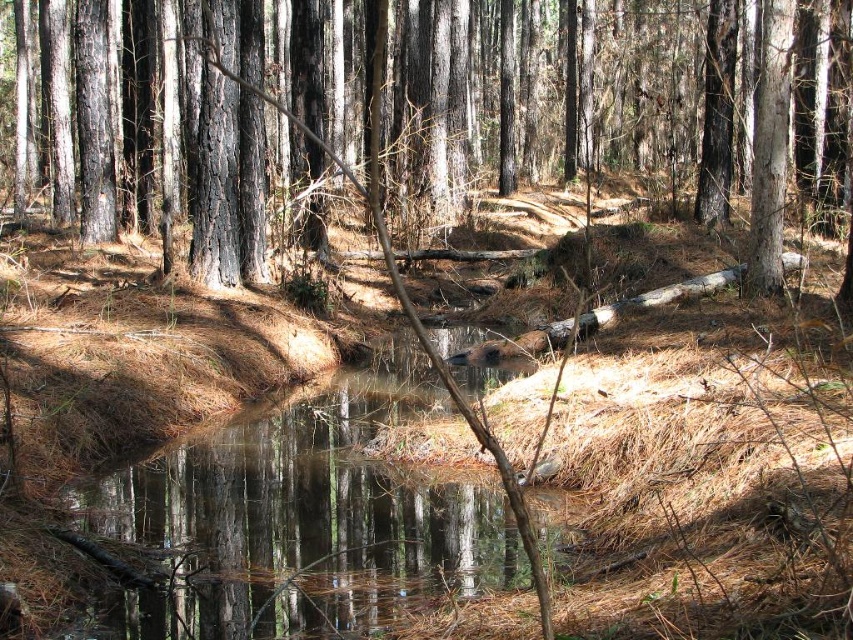
You are a hiker trying to cross the stream in the forest. You see a smooth bark tree at center and a clear water at center. Which one is wider? Please choose between the two.

The smooth bark tree at center is wider than the clear water at center according to the description.

You are a hiker who wants to cross the clear water at center. There is a smooth bark tree at center nearby. Which object is closer to you, the tree or the water?

The smooth bark tree at center is closer to you than the clear water at center, so the tree is closer.

You are a hiker who wants to cross the stream. The smooth bark tree at center and clear water at center are in your path. Which one is larger and would block your path more?

The smooth bark tree at center is bigger than clear water at center, so it would block your path more.